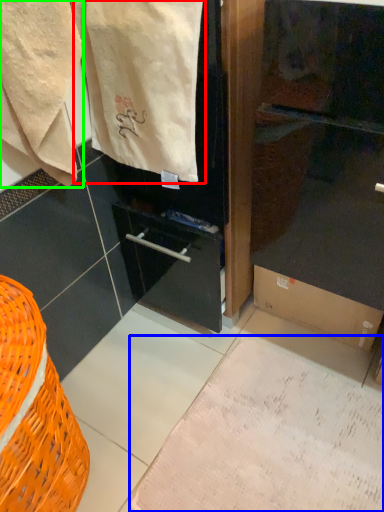
Question: Based on their relative distances, which object is nearer to bath towel (highlighted by a red box)? Choose from parchment (highlighted by a blue box) and towel (highlighted by a green box).

Choices:
 (A) parchment
 (B) towel

Answer: (B)